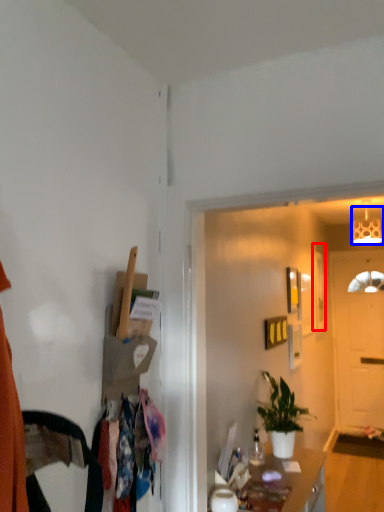
Question: Which object is closer to the camera taking this photo, picture frame (highlighted by a red box) or lamp (highlighted by a blue box)?

Choices:
 (A) picture frame
 (B) lamp

Answer: (B)